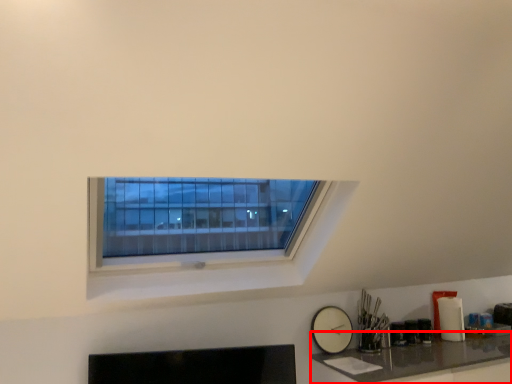
Question: Where is counter top (annotated by the red box) located in relation to clock in the image?

Choices:
 (A) right
 (B) left

Answer: (A)